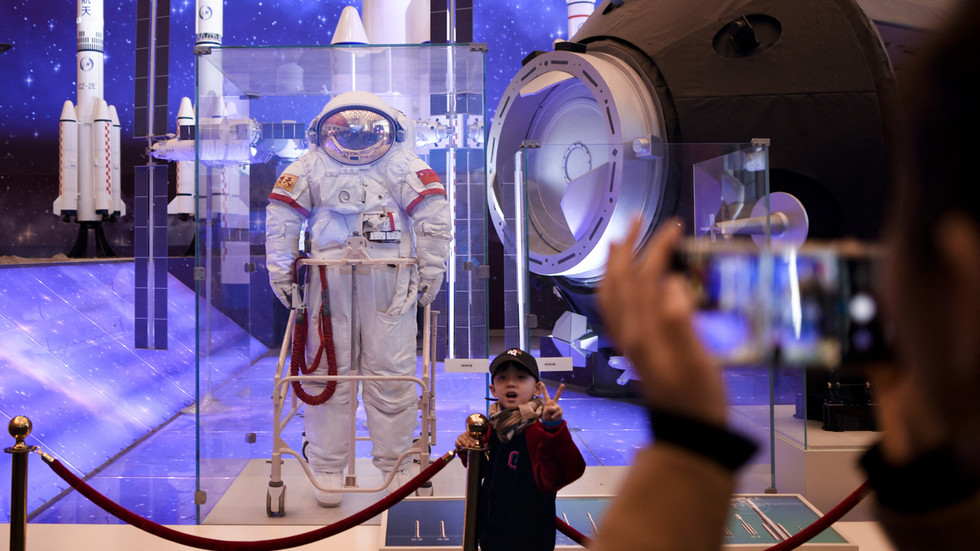
Image resolution: width=980 pixels, height=551 pixels. What are the coordinates of `floor` in the screenshot? It's located at (613, 426).